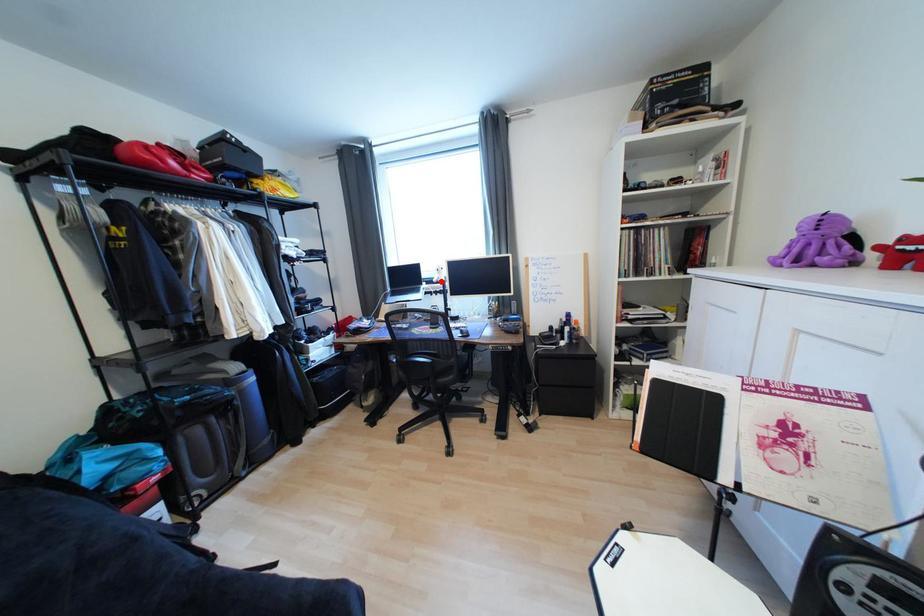
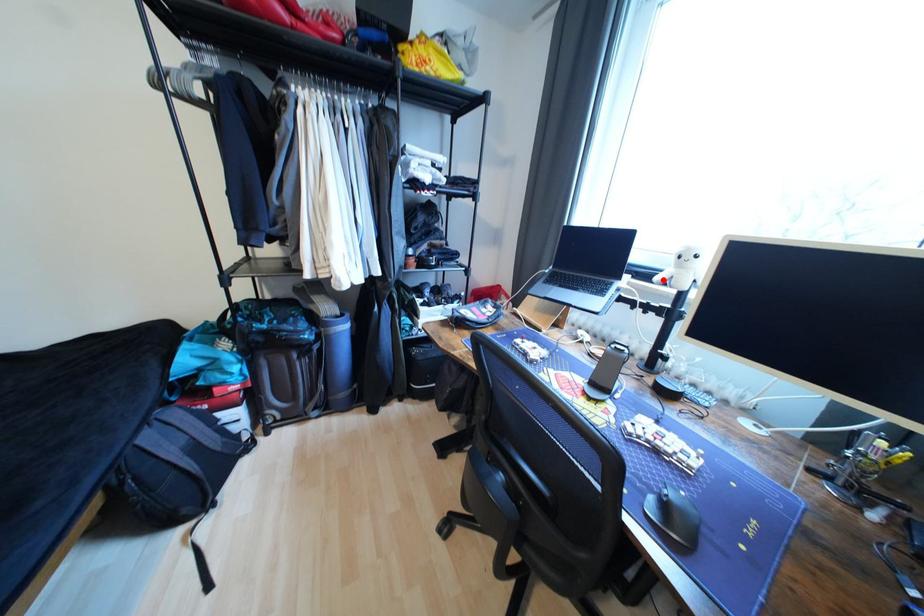
I am providing you with two images of the same scene from different viewpoints. A red point is marked on the first image and another point is marked on the second image. Do the highlighted points in image1 and image2 indicate the same real-world spot?

Yes